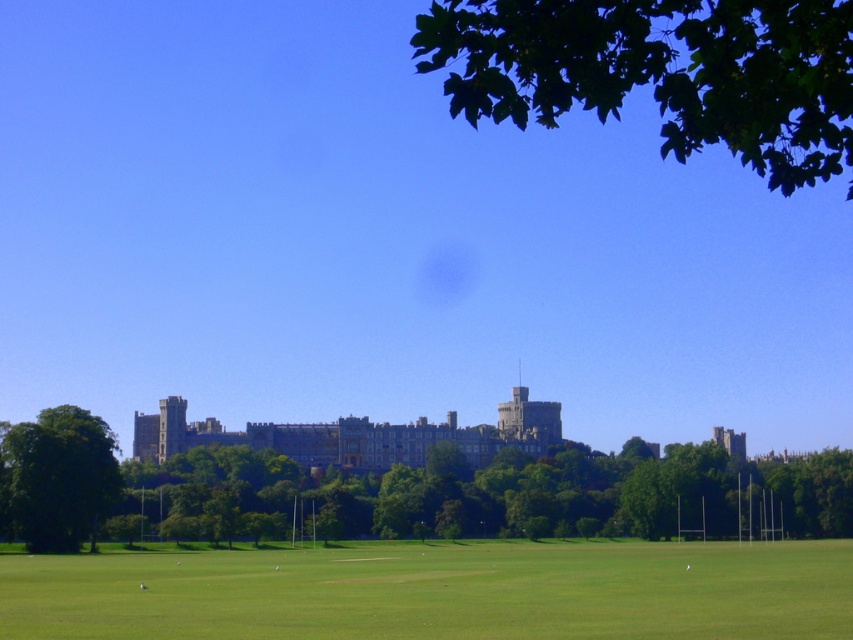
You are standing at the origin point of the coordinate system in the image. The green leafy tree at center is located at coordinates 0.767, 0.624. If you want to walk directly to the tree, which direction should you move in terms of the coordinate system?

To reach the green leafy tree at center located at coordinates (531,490), you should move in the positive x and positive y direction since both coordinates are greater than 0.5, indicating the tree is positioned towards the right and upper half of the image.

You are standing at the castle and looking out towards the field. There are two points marked on the field at coordinates point (323, 480) and point (479, 433). Which point is closer to you?

Point (323, 480) is in front of point (479, 433), so it is closer to you.

You are a drone operator tasked with capturing aerial footage of the gray stone castle at center. However, you notice the green leafy tree at upper right might obstruct the view. Can you confirm if the tree is taller than the castle?

The green leafy tree at upper right is taller than the gray stone castle at center, so it will obstruct the view.